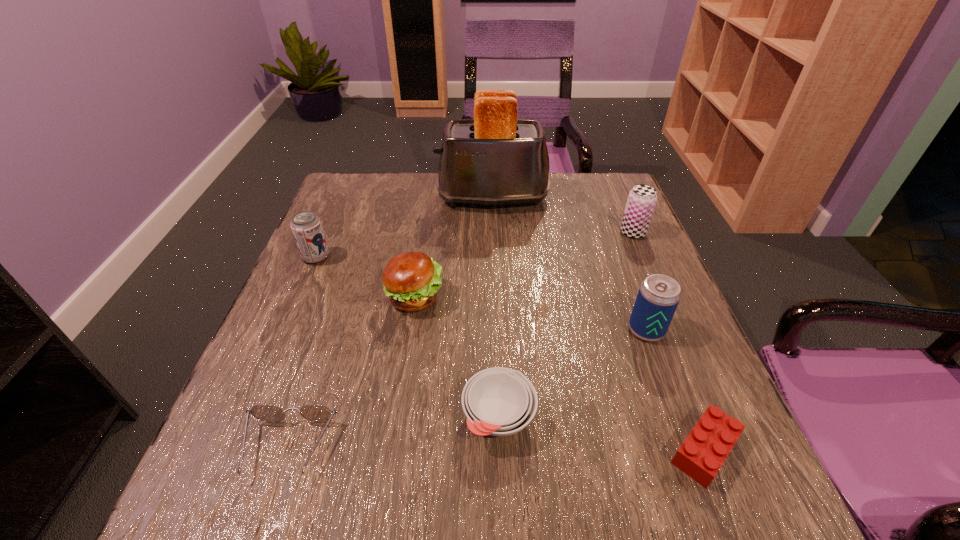
This screenshot has height=540, width=960. I want to click on the farthest object, so click(494, 159).

Locate an element on the screen. The height and width of the screenshot is (540, 960). toaster is located at coordinates (494, 159).

Where is `the second farthest object`? Image resolution: width=960 pixels, height=540 pixels. the second farthest object is located at coordinates (642, 199).

Locate an element on the screen. the nearest beer can is located at coordinates [658, 297].

You are a GUI agent. You are given a task and a screenshot of the screen. Output one action in this format:
    pyautogui.click(x=<x>, y=<y>)
    Task: Click on the sixth nearest object
    Image resolution: width=960 pixels, height=540 pixels.
    Given the screenshot: What is the action you would take?
    pyautogui.click(x=306, y=227)

Locate an element on the screen. This screenshot has height=540, width=960. the leftmost beer can is located at coordinates (306, 227).

Identify the location of hamburger. The width and height of the screenshot is (960, 540). (411, 280).

Where is `soup bowl`? This screenshot has height=540, width=960. soup bowl is located at coordinates (498, 401).

The width and height of the screenshot is (960, 540). Identify the location of spectacles. 313,412.

At what (x,y) coordinates should I click in order to perform the action: click on Lego. Please return your answer as a coordinate pair (x, y). Image resolution: width=960 pixels, height=540 pixels. Looking at the image, I should click on (705, 449).